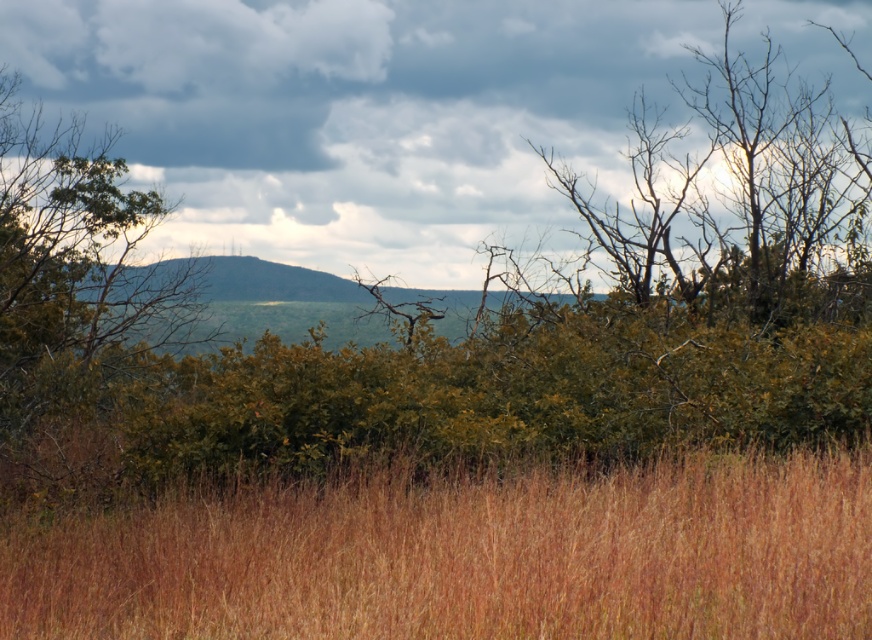
Question: Is brown dry grass at lower center further to the viewer compared to green leafy tree at left?

Choices:
 (A) no
 (B) yes

Answer: (A)

Question: Can you confirm if cloudy sky at upper center is positioned below green leafy tree at left?

Choices:
 (A) no
 (B) yes

Answer: (A)

Question: Based on their relative distances, which object is farther from the brown dry grass at lower center?

Choices:
 (A) cloudy sky at upper center
 (B) green leafy tree at left

Answer: (A)

Question: Is cloudy sky at upper center wider than brown dry grass at lower center?

Choices:
 (A) yes
 (B) no

Answer: (A)

Question: Among these objects, which one is farthest from the camera?

Choices:
 (A) cloudy sky at upper center
 (B) brown dry grass at lower center

Answer: (A)

Question: Which object is positioned farthest from the brown dry grass at lower center?

Choices:
 (A) cloudy sky at upper center
 (B) green leafy tree at left

Answer: (A)